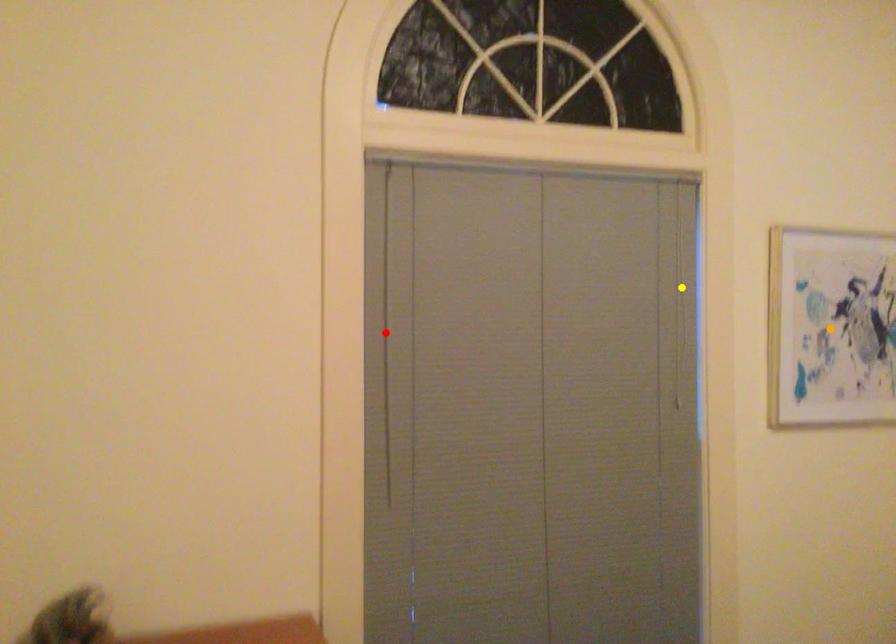
Looking at this image, order these from nearest to farthest:
red point, orange point, yellow point

1. red point
2. yellow point
3. orange point